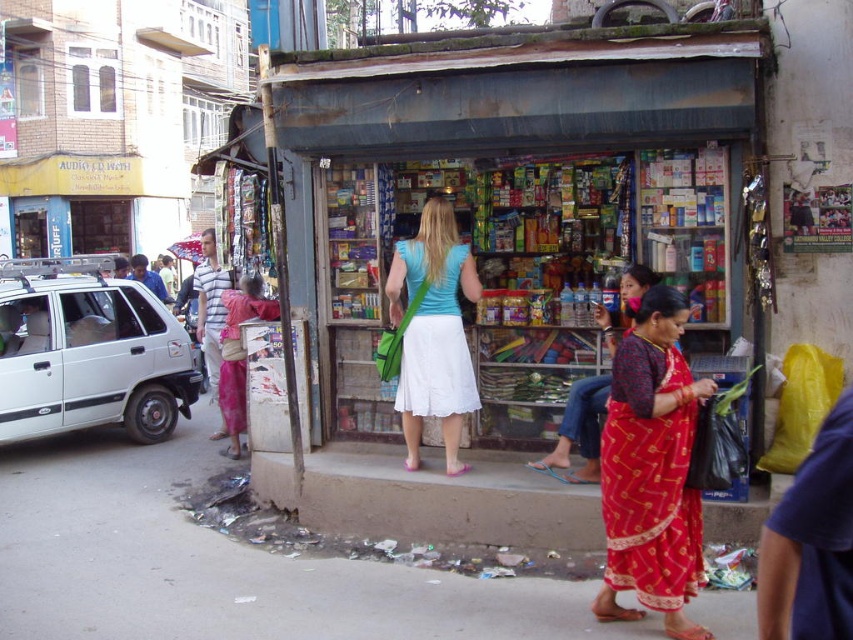
You are a delivery person trying to park your bike near the brown concrete curb at lower center. Based on the scene description, can you confirm the exact location coordinates of the curb to ensure proper parking?

The brown concrete curb at lower center is located at point (430, 499), so you can use these coordinates to park your bike accurately.

You are a delivery person who needs to place a package on the dirty concrete pavement at lower center. However, there is a red printed sari at lower right nearby. Which object is shorter so that the package can be placed without obstruction?

The dirty concrete pavement at lower center is shorter than the red printed sari at lower right, so placing the package there would not be obstructed by the sari.

You are a delivery person trying to park your bike between the brown concrete curb at lower center and the red silk saree at center. Which object should you place the bike closer to if you want to maximize space?

The brown concrete curb at lower center is larger in size than the red silk saree at center, so you should place the bike closer to the red silk saree at center to maximize available space.